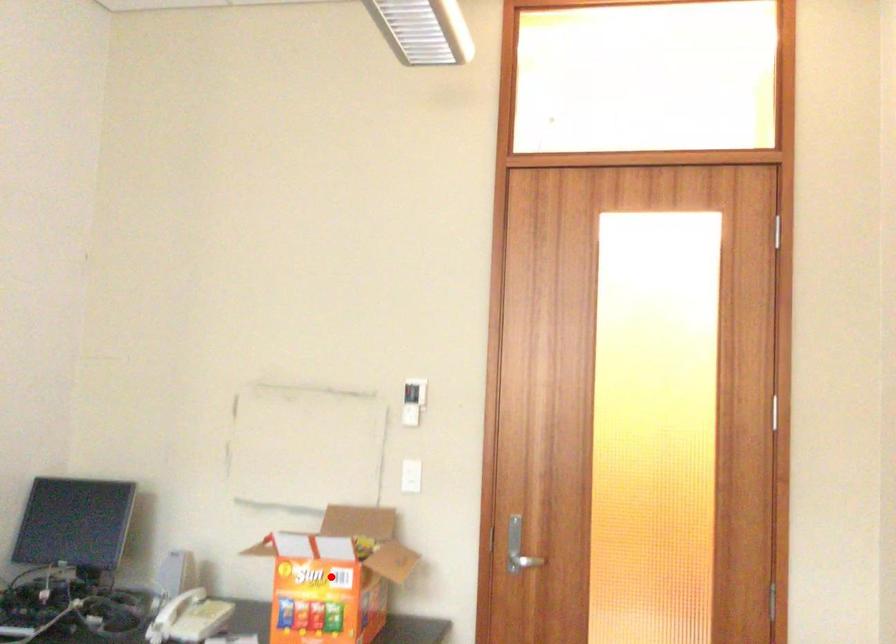
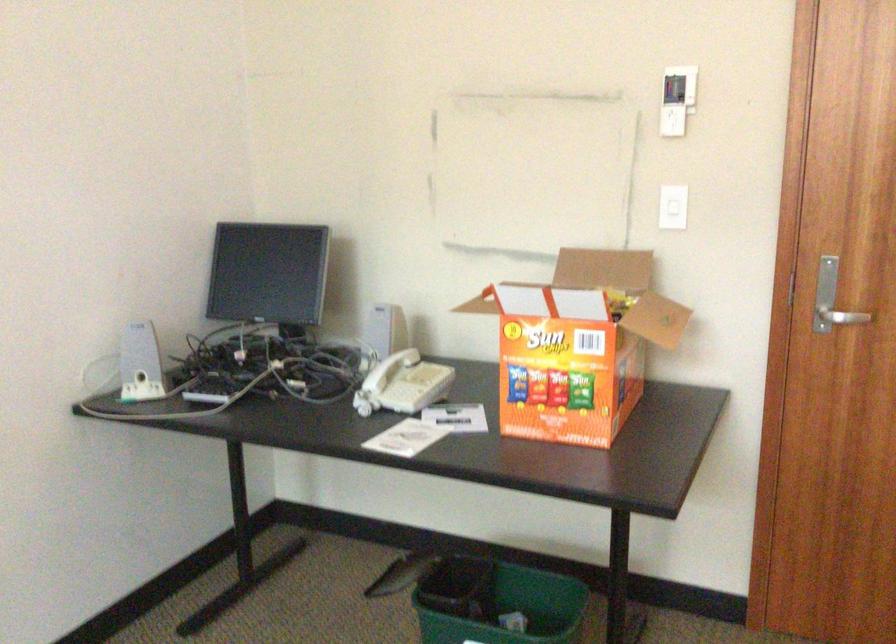
Question: A red point is marked in image1. In image2, is the corresponding 3D point closer to the camera or farther? Reply with the corresponding letter.

Choices:
 (A) The corresponding 3D point is closer.
 (B) The corresponding 3D point is farther.

Answer: (A)